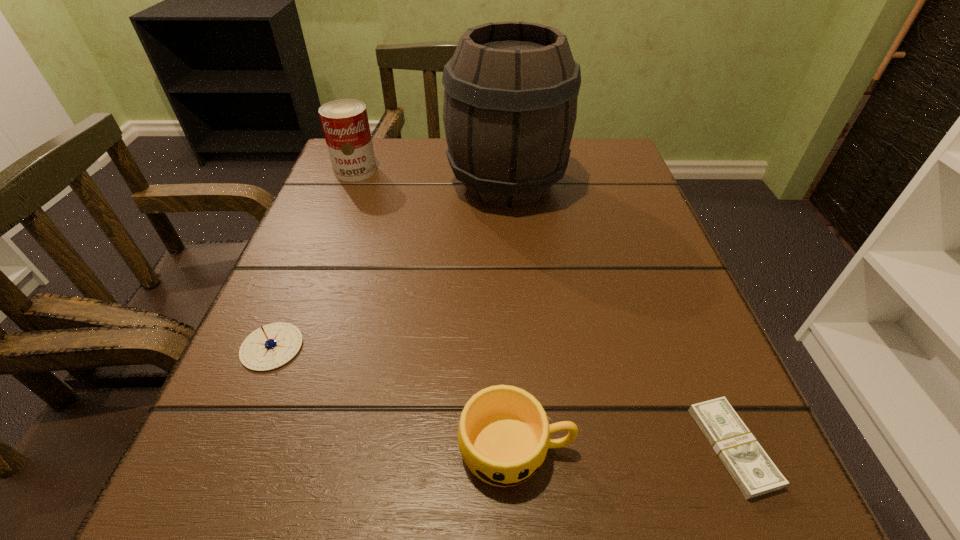
You are a GUI agent. You are given a task and a screenshot of the screen. Output one action in this format:
    pyautogui.click(x=<x>, y=<y>)
    Task: Click on the vacant space located on the right of the third farthest object
    
    Given the screenshot: What is the action you would take?
    pyautogui.click(x=337, y=347)

Locate an element on the screen. The width and height of the screenshot is (960, 540). vacant space located on the left of the shortest object is located at coordinates (642, 447).

Locate an element on the screen. This screenshot has height=540, width=960. wine bucket present at the far edge is located at coordinates (510, 101).

This screenshot has height=540, width=960. Identify the location of can located in the far edge section of the desktop. (345, 124).

Identify the location of cup present at the near edge. This screenshot has height=540, width=960. (503, 435).

The height and width of the screenshot is (540, 960). Find the location of `money present at the near edge`. money present at the near edge is located at coordinates (749, 465).

At what (x,y) coordinates should I click in order to perform the action: click on can that is positioned at the left edge. Please return your answer as a coordinate pair (x, y). Looking at the image, I should click on (345, 124).

At what (x,y) coordinates should I click in order to perform the action: click on compass situated at the left edge. Please return your answer as a coordinate pair (x, y). This screenshot has width=960, height=540. Looking at the image, I should click on (271, 346).

You are a GUI agent. You are given a task and a screenshot of the screen. Output one action in this format:
    pyautogui.click(x=<x>, y=<y>)
    Task: Click on the wine bucket positioned at the right edge
    
    Given the screenshot: What is the action you would take?
    pyautogui.click(x=510, y=101)

What are the coordinates of `money located in the right edge section of the desktop` in the screenshot? It's located at (749, 465).